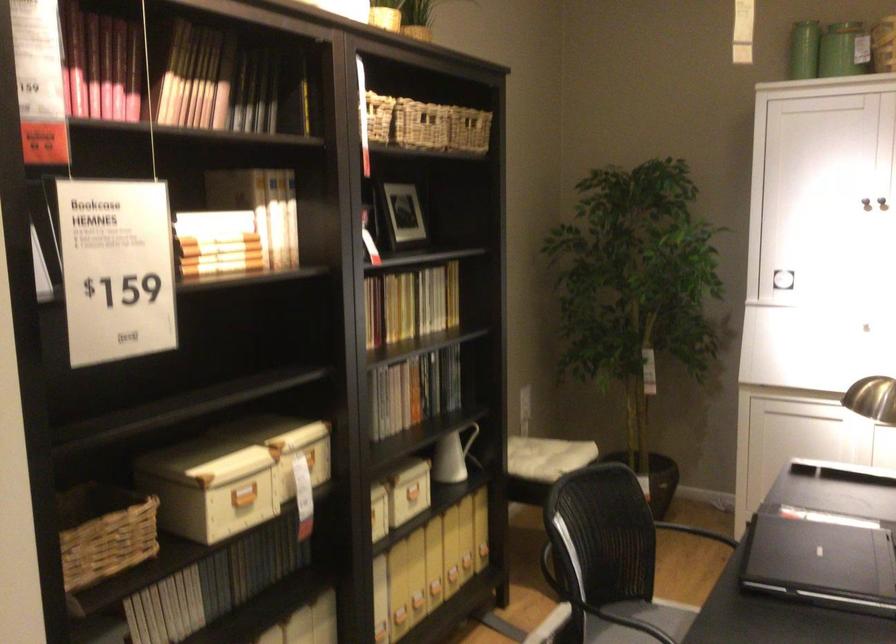
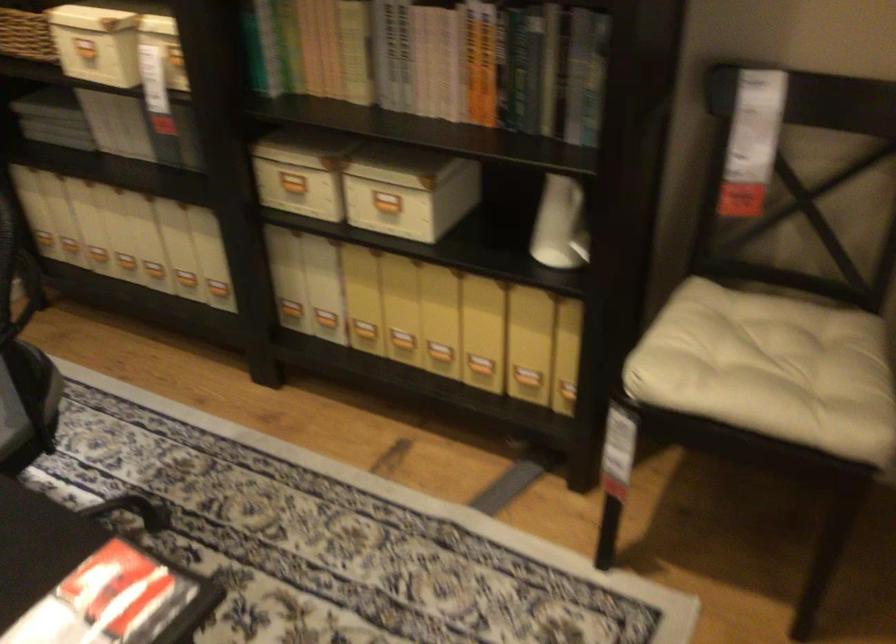
Find the pixel in the second image that matches the point at 389,512 in the first image.

(386, 204)